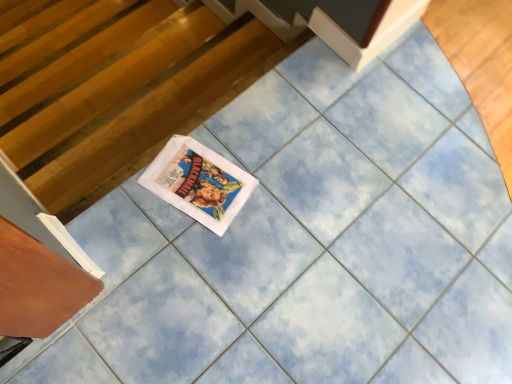
You are a GUI agent. You are given a task and a screenshot of the screen. Output one action in this format:
    pyautogui.click(x=<x>, y=<y>)
    Task: Click on the free space between white paper comic book at center and wooden drawer at lower left
    
    Given the screenshot: What is the action you would take?
    pyautogui.click(x=144, y=250)